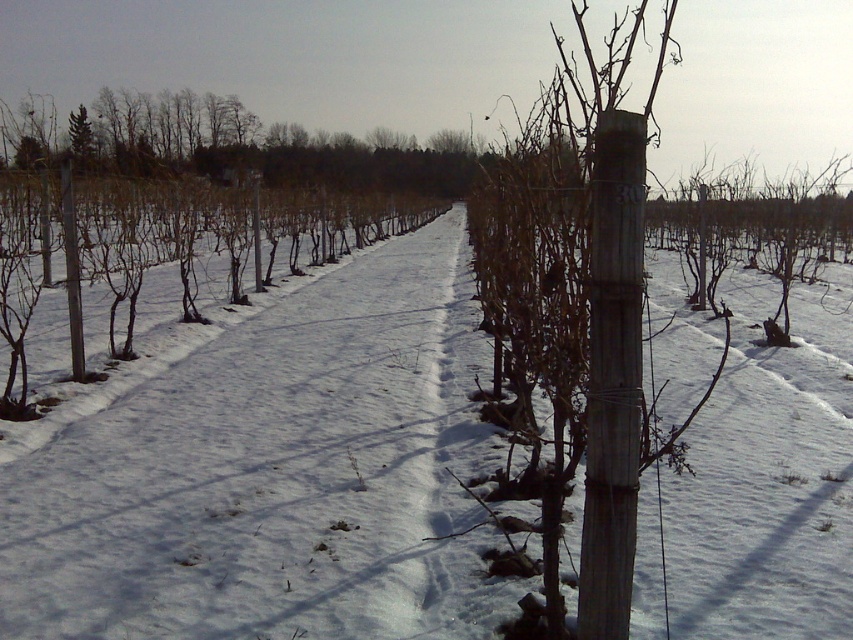
Question: Can you confirm if white powdery snow at center is smaller than gray wooden post at left?

Choices:
 (A) no
 (B) yes

Answer: (A)

Question: Which object appears farthest from the camera in this image?

Choices:
 (A) white powdery snow at center
 (B) wooden post at center

Answer: (A)

Question: Which object is the closest to the white powdery snow at center?

Choices:
 (A) wooden post at center
 (B) gray wooden post at left

Answer: (A)

Question: Is white powdery snow at center to the right of wooden post at center from the viewer's perspective?

Choices:
 (A) no
 (B) yes

Answer: (B)

Question: Among these points, which one is nearest to the camera?

Choices:
 (A) (360, 589)
 (B) (73, 228)
 (C) (589, 396)

Answer: (C)

Question: Can you confirm if wooden post at center is thinner than gray wooden post at left?

Choices:
 (A) yes
 (B) no

Answer: (B)